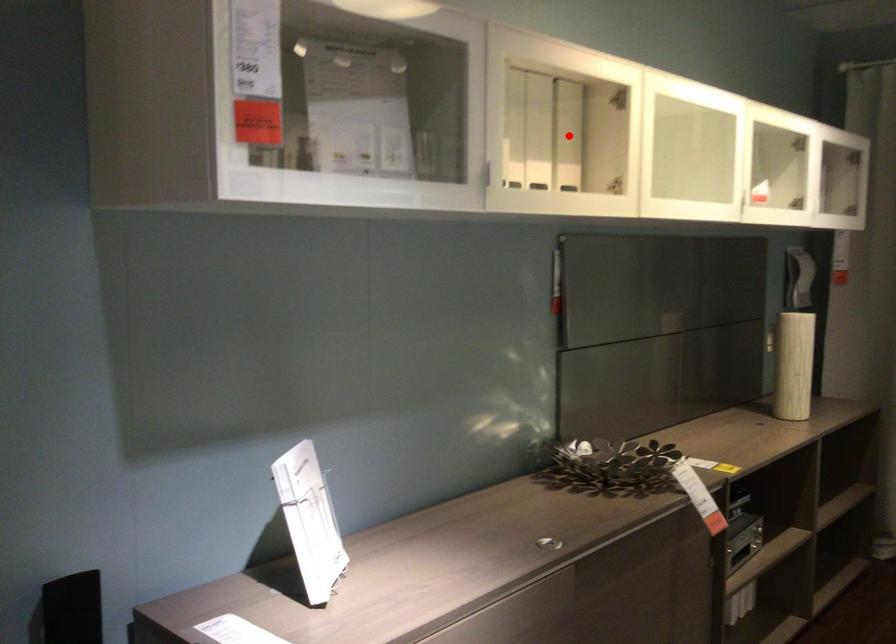
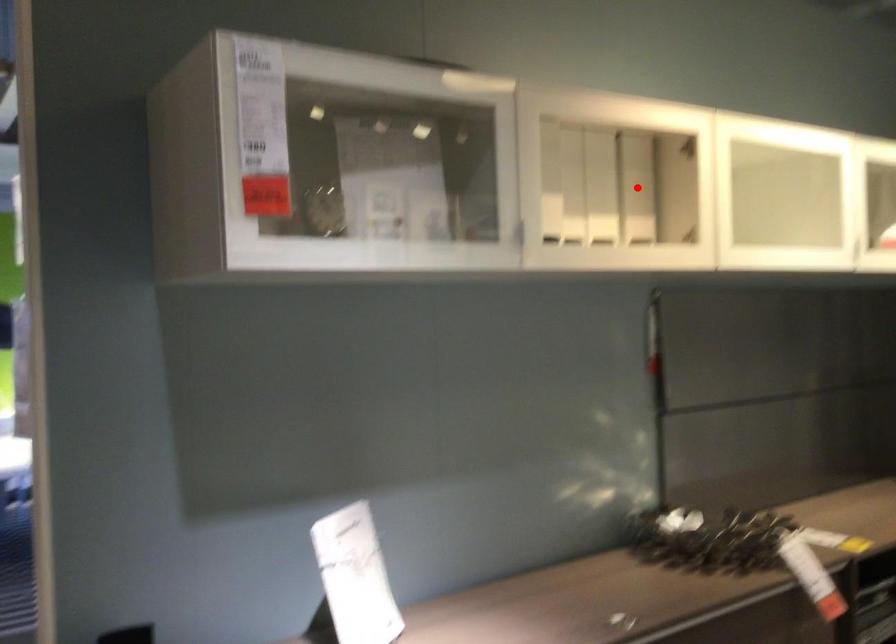
I am providing you with two images of the same scene from different viewpoints. A red point is marked on the first image and another point is marked on the second image. Do the highlighted points in image1 and image2 indicate the same real-world spot?

Yes